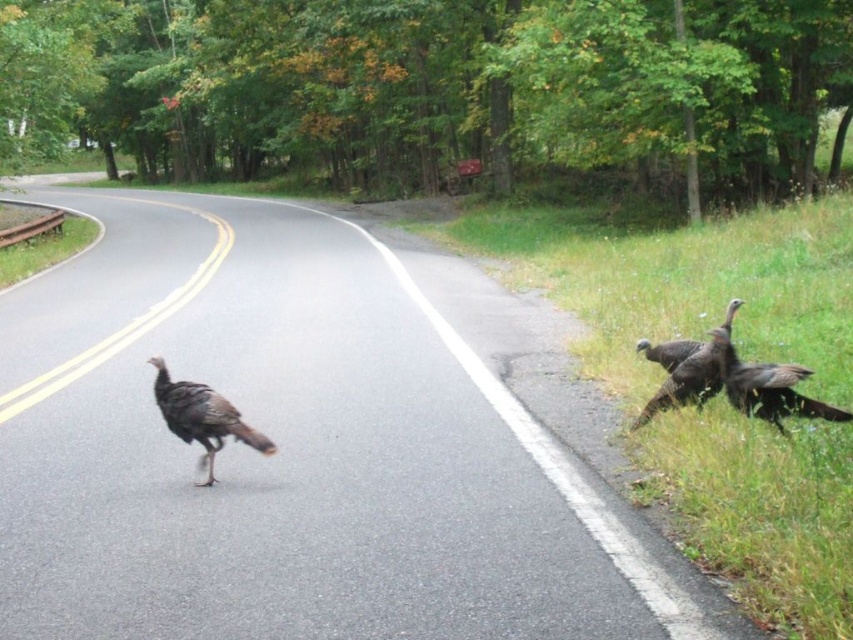
Question: Does brown speckled feathers at road center lie behind dark brown feathers at right?

Choices:
 (A) yes
 (B) no

Answer: (B)

Question: Which of these objects is positioned closest to the black asphalt highway at center?

Choices:
 (A) brown speckled feathers at road center
 (B) dark brown feathers at right

Answer: (A)

Question: Among these points, which one is farthest from the camera?

Choices:
 (A) (169, 397)
 (B) (675, 369)

Answer: (B)

Question: Is black asphalt highway at center to the right of brown speckled feathers at road center from the viewer's perspective?

Choices:
 (A) no
 (B) yes

Answer: (A)

Question: Which point is farther from the camera taking this photo?

Choices:
 (A) tap(242, 433)
 (B) tap(323, 356)

Answer: (B)

Question: Can you confirm if black asphalt highway at center is wider than brown speckled feathers at road center?

Choices:
 (A) no
 (B) yes

Answer: (B)